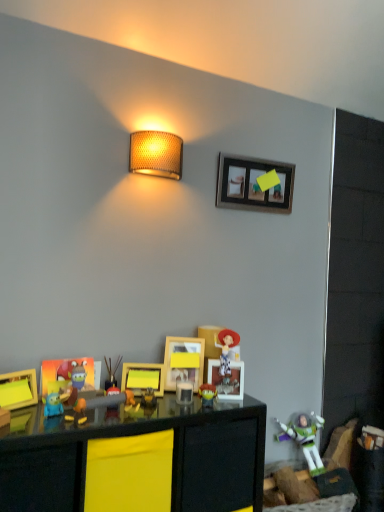
What is the approximate width of matte plastic toy at center, positioned as the 3th toy in left-to-right order?

matte plastic toy at center, positioned as the 3th toy in left-to-right order, is 2.54 inches wide.

Image resolution: width=384 pixels, height=512 pixels. Describe the element at coordinates (207, 394) in the screenshot. I see `matte plastic toy at center, arranged as the third toy when viewed from the top` at that location.

Where is `wooden picture frame at upper center, acting as the 5th picture frame starting from the bottom`? wooden picture frame at upper center, acting as the 5th picture frame starting from the bottom is located at coordinates (254, 184).

This screenshot has height=512, width=384. Describe the element at coordinates (143, 378) in the screenshot. I see `yellow matte picture frame at center, placed as the 3th picture frame when sorted from right to left` at that location.

What do you see at coordinates (111, 373) in the screenshot? I see `matte plastic toy at center, marked as the 4th toy in a bottom-to-top arrangement` at bounding box center [111, 373].

You are a GUI agent. You are given a task and a screenshot of the screen. Output one action in this format:
    pyautogui.click(x=<x>, y=<y>)
    Task: Click on the matte plastic toy at center, which is counted as the 3th toy, starting from the back
    Image resolution: width=384 pixels, height=512 pixels.
    Given the screenshot: What is the action you would take?
    pyautogui.click(x=207, y=394)

Consider the image. Is matte plastic toy at center, which is counted as the 3th toy, starting from the back, shorter than yellow matte picture frame at center, the 3th picture frame viewed from the front?

Yes, matte plastic toy at center, which is counted as the 3th toy, starting from the back, is shorter than yellow matte picture frame at center, the 3th picture frame viewed from the front.

Which is correct: matte plastic toy at center, which appears as the 2th toy when viewed from the front, is inside yellow matte picture frame at center, acting as the first picture frame starting from the bottom, or outside of it?

matte plastic toy at center, which appears as the 2th toy when viewed from the front, is spatially situated outside yellow matte picture frame at center, acting as the first picture frame starting from the bottom.

At what (x,y) coordinates should I click in order to perform the action: click on the 1st picture frame behind the matte plastic toy at center, positioned as the 3th toy in left-to-right order. Please return your answer as a coordinate pair (x, y). This screenshot has width=384, height=512. Looking at the image, I should click on (143, 378).

Would you say matte plastic toy at center, which is counted as the 3th toy, starting from the back, is to the left or to the right of yellow matte picture frame at center, the 3th picture frame in the left-to-right sequence, in the picture?

Based on their positions, matte plastic toy at center, which is counted as the 3th toy, starting from the back, is located to the right of yellow matte picture frame at center, the 3th picture frame in the left-to-right sequence.

Considering the positions of objects matte plastic toy at center, positioned as the 3th toy in right-to-left order, and matte plastic picture frame at lower left, which is counted as the fourth picture frame, starting from the right, in the image provided, who is more to the right, matte plastic toy at center, positioned as the 3th toy in right-to-left order, or matte plastic picture frame at lower left, which is counted as the fourth picture frame, starting from the right,?

matte plastic toy at center, positioned as the 3th toy in right-to-left order, is more to the right.

Can you confirm if matte plastic toy at center, positioned as the 3th toy in right-to-left order, is smaller than matte plastic picture frame at lower left, the 2th picture frame in the front-to-back sequence?

Yes, matte plastic toy at center, positioned as the 3th toy in right-to-left order, is smaller than matte plastic picture frame at lower left, the 2th picture frame in the front-to-back sequence.

This screenshot has width=384, height=512. I want to click on toy that is the 2nd object located behind the matte plastic picture frame at lower left, which is counted as the fourth picture frame, starting from the right, so click(x=111, y=373).

Could you tell me if matte plastic toy at center, marked as the 4th toy in a bottom-to-top arrangement, is turned towards matte plastic picture frame at lower left, which is the 2th picture frame in left-to-right order?

No, matte plastic toy at center, marked as the 4th toy in a bottom-to-top arrangement, is not facing towards matte plastic picture frame at lower left, which is the 2th picture frame in left-to-right order.

From the matte plastic toy at center, which is the 2th toy in back-to-front order, count 1st picture frame to the right and point to it. Please provide its 2D coordinates.

[(143, 378)]

Does yellow matte picture frame at center, the 3th picture frame in the left-to-right sequence, appear on the left side of matte plastic toy at center, which ranks as the first toy in top-to-bottom order?

No.

From the image's perspective, is yellow matte picture frame at center, which ranks as the third picture frame in back-to-front order, located above or below matte plastic toy at center, positioned as the third toy in front-to-back order?

Based on their image positions, yellow matte picture frame at center, which ranks as the third picture frame in back-to-front order, is located beneath matte plastic toy at center, positioned as the third toy in front-to-back order.

Considering the relative sizes of yellow matte picture frame at center, placed as the 3th picture frame when sorted from right to left, and matte plastic toy at center, which is the 2th toy in back-to-front order, in the image provided, is yellow matte picture frame at center, placed as the 3th picture frame when sorted from right to left, taller than matte plastic toy at center, which is the 2th toy in back-to-front order,?

No, yellow matte picture frame at center, placed as the 3th picture frame when sorted from right to left, is not taller than matte plastic toy at center, which is the 2th toy in back-to-front order.

Which is more to the right, matte plastic toy at center, marked as the 4th toy in a bottom-to-top arrangement, or plastic buzz lightyear at lower right, which is the 4th toy in top-to-bottom order?

From the viewer's perspective, plastic buzz lightyear at lower right, which is the 4th toy in top-to-bottom order, appears more on the right side.

In the image, is matte plastic toy at center, marked as the 4th toy in a bottom-to-top arrangement, positioned in front of or behind plastic buzz lightyear at lower right, which is counted as the 4th toy, starting from the left?

matte plastic toy at center, marked as the 4th toy in a bottom-to-top arrangement, is in front of plastic buzz lightyear at lower right, which is counted as the 4th toy, starting from the left.

From the image's perspective, which is above, matte plastic toy at center, which is the 2th toy in back-to-front order, or plastic buzz lightyear at lower right, marked as the first toy in a bottom-to-top arrangement?

matte plastic toy at center, which is the 2th toy in back-to-front order, from the image's perspective.

How different are the orientations of matte plastic toy at center, the second toy from the bottom, and matte plastic toy at center, positioned as the third toy in front-to-back order, in degrees?

matte plastic toy at center, the second toy from the bottom, and matte plastic toy at center, positioned as the third toy in front-to-back order, are facing 9.34 degrees away from each other.

Consider the image. Could you tell me if matte plastic toy at center, which is counted as the 3th toy, starting from the back, is turned towards matte plastic toy at center, the 2th toy viewed from the left?

No, matte plastic toy at center, which is counted as the 3th toy, starting from the back, does not turn towards matte plastic toy at center, the 2th toy viewed from the left.

Consider the image. Between matte plastic toy at center, the second toy from the bottom, and matte plastic toy at center, which ranks as the first toy in top-to-bottom order, which one appears on the left side from the viewer's perspective?

matte plastic toy at center, which ranks as the first toy in top-to-bottom order.

From the matte plastic toy at center, which ranks as the first toy in top-to-bottom order, count 1st toy to the right and point to it. Please provide its 2D coordinates.

[(207, 394)]

From a real-world perspective, is matte yellow picture frame at lower left, which appears as the 5th picture frame when viewed from the right, physically below plastic buzz lightyear at lower right, marked as the first toy in a bottom-to-top arrangement?

Actually, matte yellow picture frame at lower left, which appears as the 5th picture frame when viewed from the right, is physically above plastic buzz lightyear at lower right, marked as the first toy in a bottom-to-top arrangement, in the real world.

Which is closer, (x=21, y=384) or (x=303, y=441)?

Point (x=21, y=384)

Considering the relative sizes of matte yellow picture frame at lower left, which ranks as the third picture frame in bottom-to-top order, and plastic buzz lightyear at lower right, which is counted as the 4th toy, starting from the left, in the image provided, is matte yellow picture frame at lower left, which ranks as the third picture frame in bottom-to-top order, thinner than plastic buzz lightyear at lower right, which is counted as the 4th toy, starting from the left,?

Yes.

Is matte yellow picture frame at lower left, the fifth picture frame positioned from the back, completely or partially outside of plastic buzz lightyear at lower right, arranged as the 4th toy when viewed from the front?

Yes.

From the image's perspective, which toy is the 1st one above the matte plastic toy at center, which is counted as the 3th toy, starting from the back? Please provide its 2D coordinates.

[(54, 405)]

From a real-world perspective, is matte plastic toy at center, positioned as the 3th toy in left-to-right order, physically below matte blue toy at lower left, positioned as the 1th toy in front-to-back order?

No.

From the image's perspective, is matte plastic toy at center, which is counted as the 3th toy, starting from the back, located above or below matte blue toy at lower left, which ranks as the 1th toy in left-to-right order?

matte plastic toy at center, which is counted as the 3th toy, starting from the back, is below matte blue toy at lower left, which ranks as the 1th toy in left-to-right order.

Is matte plastic toy at center, which appears as the 2th toy when viewed from the front, inside or outside of matte blue toy at lower left, positioned as the 1th toy in front-to-back order?

matte plastic toy at center, which appears as the 2th toy when viewed from the front, is located beyond the bounds of matte blue toy at lower left, positioned as the 1th toy in front-to-back order.

Starting from the matte plastic toy at center, which appears as the 2th toy when viewed from the front, which picture frame is the 1st one behind? Please provide its 2D coordinates.

[(143, 378)]

Identify the location of the 1st picture frame counting from the left side of the matte plastic toy at center, marked as the 4th toy in a bottom-to-top arrangement. This screenshot has height=512, width=384. (64, 374).

From the image, which object appears to be farther from matte yellow picture frame at lower left, the 1th picture frame in the front-to-back sequence, matte blue toy at lower left, marked as the second toy in a top-to-bottom arrangement, or matte plastic toy at center, positioned as the third toy in front-to-back order?

The object further to matte yellow picture frame at lower left, the 1th picture frame in the front-to-back sequence, is matte plastic toy at center, positioned as the third toy in front-to-back order.

When comparing their distances from wooden picture frame at upper center, placed as the fifth picture frame when sorted from front to back, does matte plastic picture frame at lower left, the 2th picture frame in the front-to-back sequence, or yellow matte picture frame at center, acting as the 2th picture frame starting from the top, seem further?

matte plastic picture frame at lower left, the 2th picture frame in the front-to-back sequence, is positioned further to the anchor wooden picture frame at upper center, placed as the fifth picture frame when sorted from front to back.

Based on the photo, when comparing their distances from matte yellow picture frame at lower left, the first picture frame from the left, does plastic buzz lightyear at lower right, which is counted as the first toy, starting from the back, or matte blue toy at lower left, which ranks as the 1th toy in left-to-right order, seem further?

The object further to matte yellow picture frame at lower left, the first picture frame from the left, is plastic buzz lightyear at lower right, which is counted as the first toy, starting from the back.

Looking at the image, which one is located further to woven beige lampshade at upper center, matte plastic toy at center, positioned as the 3th toy in right-to-left order, or matte blue toy at lower left, which ranks as the 1th toy in left-to-right order?

matte blue toy at lower left, which ranks as the 1th toy in left-to-right order.

When comparing their distances from yellow matte picture frame at center, the 4th picture frame in the bottom-to-top sequence, does plastic buzz lightyear at lower right, marked as the first toy in a bottom-to-top arrangement, or matte yellow picture frame at lower left, the 1th picture frame in the front-to-back sequence, seem further?

The object further to yellow matte picture frame at center, the 4th picture frame in the bottom-to-top sequence, is plastic buzz lightyear at lower right, marked as the first toy in a bottom-to-top arrangement.

When comparing their distances from yellow matte picture frame at center, the fourth picture frame viewed from the left, does matte blue toy at lower left, marked as the second toy in a top-to-bottom arrangement, or matte plastic toy at center, which appears as the 2th toy when viewed from the front, seem further?

Among the two, matte blue toy at lower left, marked as the second toy in a top-to-bottom arrangement, is located further to yellow matte picture frame at center, the fourth picture frame viewed from the left.

Based on their spatial positions, is matte plastic picture frame at lower left, the fourth picture frame when ordered from top to bottom, or matte yellow picture frame at lower left, which ranks as the third picture frame in bottom-to-top order, further from matte plastic toy at center, the 2th toy viewed from the left?

matte yellow picture frame at lower left, which ranks as the third picture frame in bottom-to-top order, is further to matte plastic toy at center, the 2th toy viewed from the left.

Looking at the image, which one is located further to yellow matte picture frame at center, the 4th picture frame in the bottom-to-top sequence, matte yellow picture frame at lower left, which appears as the 5th picture frame when viewed from the right, or woven beige lampshade at upper center?

woven beige lampshade at upper center lies further to yellow matte picture frame at center, the 4th picture frame in the bottom-to-top sequence, than the other object.

At what (x,y) coordinates should I click in order to perform the action: click on table between matte blue toy at lower left, positioned as the 1th toy in front-to-back order, and matte plastic toy at center, arranged as the 2th toy when viewed from the right. Please return your answer as a coordinate pair (x, y). Image resolution: width=384 pixels, height=512 pixels. Looking at the image, I should click on (137, 460).

This screenshot has width=384, height=512. Identify the location of picture frame located between matte plastic toy at center, the 2th toy viewed from the left, and yellow matte picture frame at center, acting as the 2th picture frame starting from the top, in the left-right direction. (143, 378).

Identify the location of table located between matte yellow picture frame at lower left, the fifth picture frame positioned from the back, and plastic buzz lightyear at lower right, marked as the first toy in a bottom-to-top arrangement, in the left-right direction. (137, 460).

What are the coordinates of `toy between wooden picture frame at upper center, the first picture frame viewed from the top, and matte blue toy at lower left, the 4th toy positioned from the right, vertically` in the screenshot? It's located at 111,373.